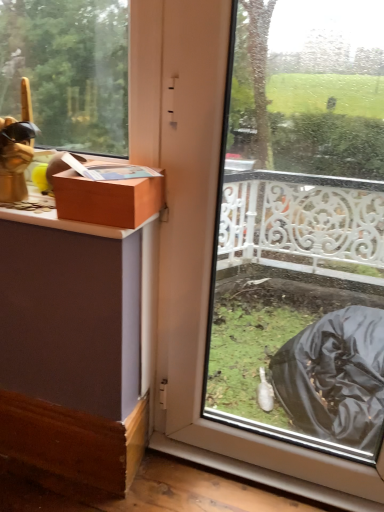
You are a GUI agent. You are given a task and a screenshot of the screen. Output one action in this format:
    pyautogui.click(x=<x>, y=<y>)
    Task: Click on the free space above matte brown box at upper left (from a real-world perspective)
    This screenshot has width=384, height=512.
    Given the screenshot: What is the action you would take?
    pyautogui.click(x=117, y=168)